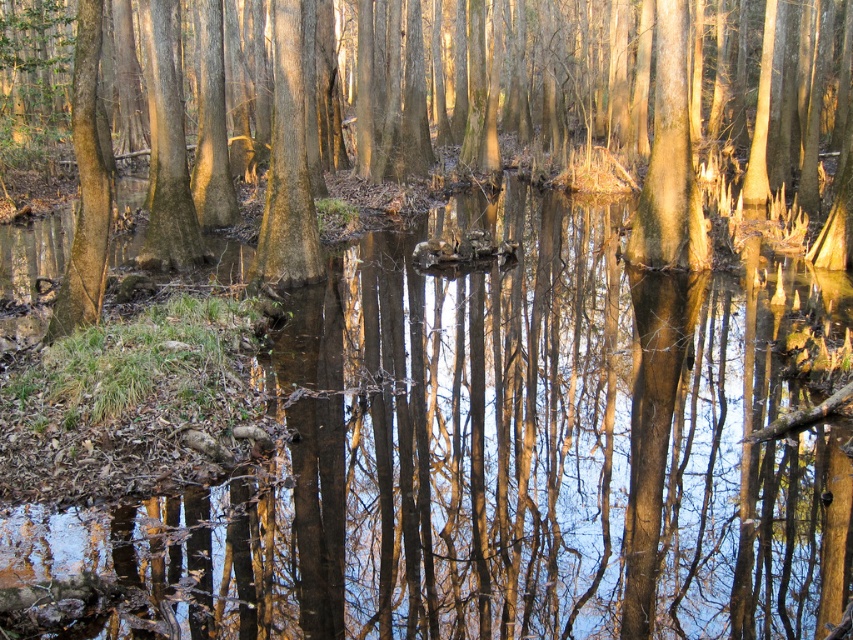
Which is below, clear water at center or smooth brown tree trunk at center?

clear water at center

Looking at this image, is clear water at center shorter than smooth brown tree trunk at center?

Yes, clear water at center is shorter than smooth brown tree trunk at center.

Locate an element on the screen. Image resolution: width=853 pixels, height=640 pixels. clear water at center is located at coordinates (514, 452).